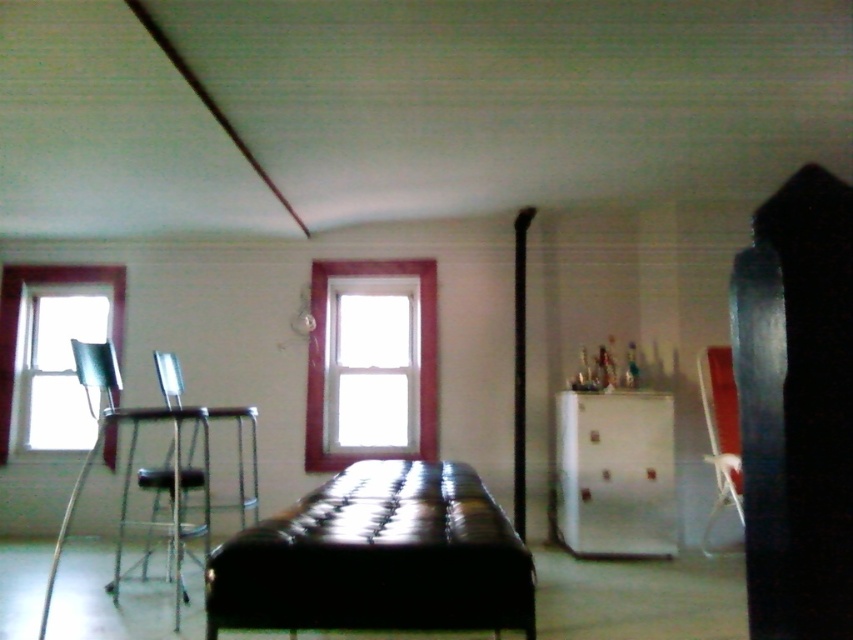
You are standing at the point marked as point (322, 381) in the room. You want to move to the nearest window. Which direction should you head towards?

The nearest window is to the left of the point 0.599, 0.379. You should head towards the left.

You are standing in the room and want to place a new rug that is 1.5 meters wide. The rug needs to be centered exactly at the same position as the black leather bed at center. Is there enough space in the room to place the rug without overlapping any walls or windows?

The black leather bed at center is positioned at coordinates point (x=376, y=557). Since the rug needs to be placed at the same position and is 1.5 meters wide, there should be sufficient space as long as the room dimensions allow. However, without specific room size details, we can confirm the rug can be centered at the bed without immediate obstruction from walls or windows based on the provided coordinates.

You are a person who is 1.6 meters tall. You want to sit on the black leather bed at center and then move to the metallic silver chair at left. Which one will require you to climb higher?

The metallic silver chair at left requires climbing higher because it has a greater height than the black leather bed at center.